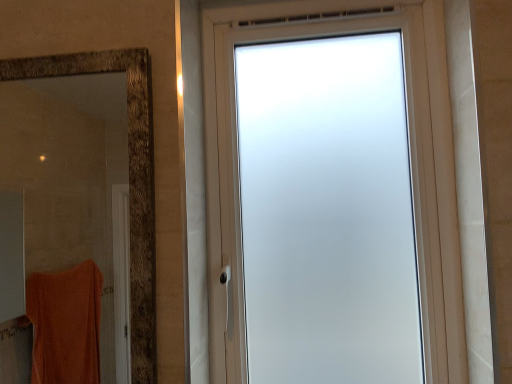
Question: Is frosted glass window at center oriented away from brown textured mirror at left?

Choices:
 (A) yes
 (B) no

Answer: (B)

Question: Can you confirm if frosted glass window at center is shorter than brown textured mirror at left?

Choices:
 (A) no
 (B) yes

Answer: (A)

Question: From the image's perspective, is frosted glass window at center beneath brown textured mirror at left?

Choices:
 (A) yes
 (B) no

Answer: (B)

Question: From a real-world perspective, is frosted glass window at center on brown textured mirror at left?

Choices:
 (A) no
 (B) yes

Answer: (B)

Question: Is the depth of frosted glass window at center less than that of brown textured mirror at left?

Choices:
 (A) no
 (B) yes

Answer: (A)

Question: Is frosted glass window at center outside brown textured mirror at left?

Choices:
 (A) yes
 (B) no

Answer: (A)

Question: Is brown textured mirror at left positioned far away from frosted glass window at center?

Choices:
 (A) yes
 (B) no

Answer: (A)

Question: Does brown textured mirror at left have a greater height compared to frosted glass window at center?

Choices:
 (A) yes
 (B) no

Answer: (B)

Question: From the image's perspective, would you say brown textured mirror at left is positioned over frosted glass window at center?

Choices:
 (A) yes
 (B) no

Answer: (B)

Question: Is brown textured mirror at left thinner than frosted glass window at center?

Choices:
 (A) yes
 (B) no

Answer: (A)

Question: Considering the relative positions of brown textured mirror at left and frosted glass window at center in the image provided, is brown textured mirror at left to the left of frosted glass window at center from the viewer's perspective?

Choices:
 (A) no
 (B) yes

Answer: (B)

Question: Is brown textured mirror at left positioned beyond the bounds of frosted glass window at center?

Choices:
 (A) no
 (B) yes

Answer: (B)

Question: Based on their sizes in the image, would you say brown textured mirror at left is bigger or smaller than frosted glass window at center?

Choices:
 (A) big
 (B) small

Answer: (B)